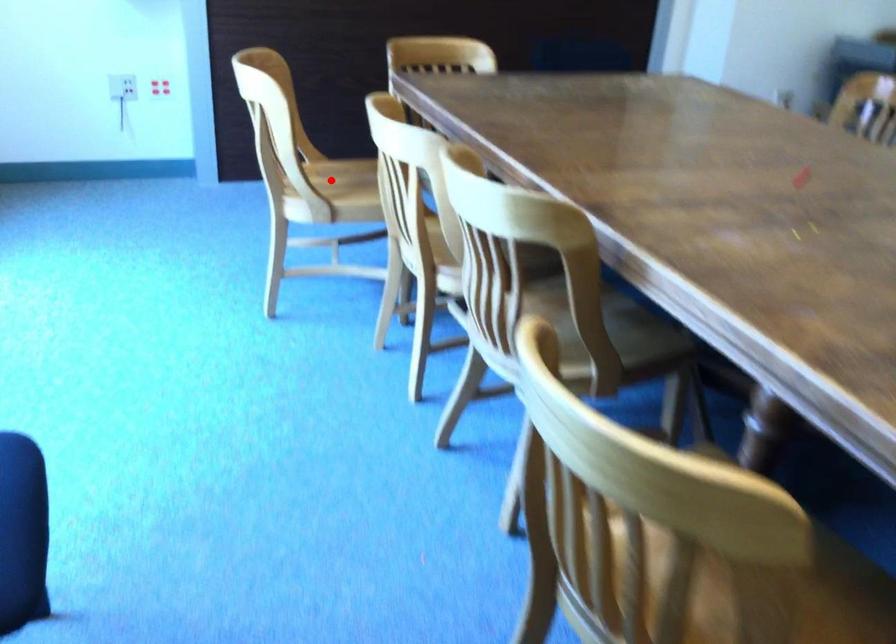
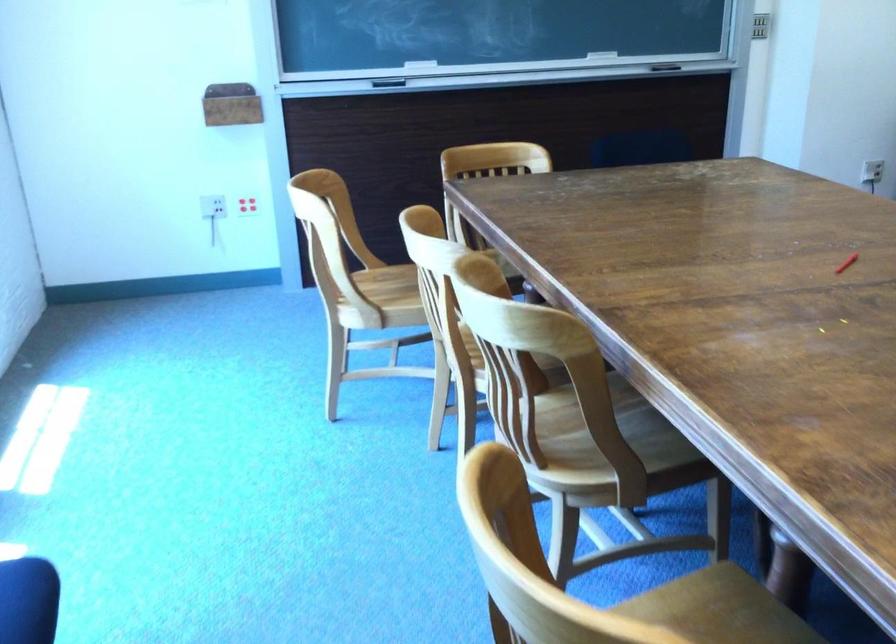
Locate, in the second image, the point that corresponds to the highlighted location in the first image.

(393, 286)